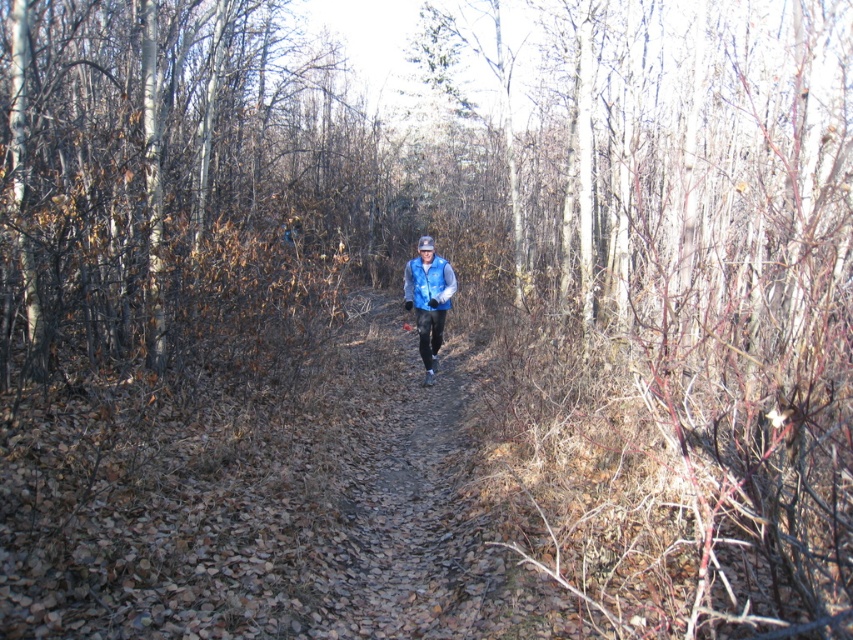
Does brown bark tree at left appear on the right side of blue fleece vest at center?

In fact, brown bark tree at left is to the left of blue fleece vest at center.

Does point (204, 61) come farther from viewer compared to point (445, 272)?

Yes.

Is point (310, 300) farther from camera compared to point (426, 237)?

Yes, point (310, 300) is behind point (426, 237).

Where is `brown bark tree at left`? The image size is (853, 640). brown bark tree at left is located at coordinates (173, 186).